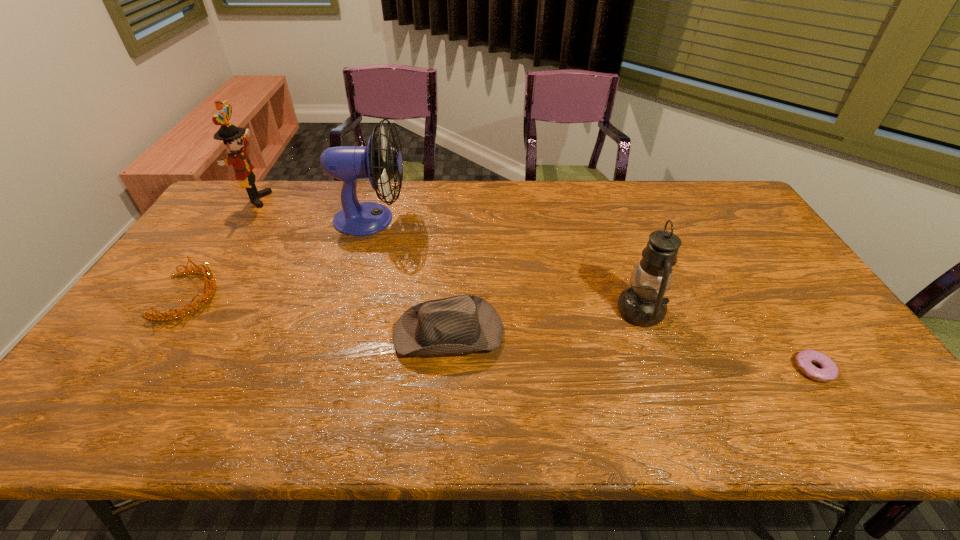
In order to click on vacant space located in front of the fourth object from right to left where the airflow is directed in this screenshot , I will do `click(470, 219)`.

Find the location of a particular element. vacant space located on the back of the oil lamp is located at coordinates (614, 237).

Locate an element on the screen. The height and width of the screenshot is (540, 960). free spot located 0.220m on the left of the fourth object from left to right is located at coordinates (308, 332).

I want to click on vacant space located on the front-facing side of the fifth tallest object, so click(271, 296).

In order to click on vacant space situated on the left of the rightmost object in this screenshot , I will do `click(690, 369)`.

Locate an element on the screen. This screenshot has width=960, height=540. nutcracker that is at the far edge is located at coordinates (231, 135).

Image resolution: width=960 pixels, height=540 pixels. I want to click on fan situated at the far edge, so click(346, 163).

Identify the location of nutcracker that is at the left edge. The height and width of the screenshot is (540, 960). (231, 135).

I want to click on tiara positioned at the left edge, so click(208, 273).

You are a GUI agent. You are given a task and a screenshot of the screen. Output one action in this format:
    pyautogui.click(x=<x>, y=<y>)
    Task: Click on the object that is at the right edge
    This screenshot has height=540, width=960.
    Given the screenshot: What is the action you would take?
    pyautogui.click(x=829, y=371)